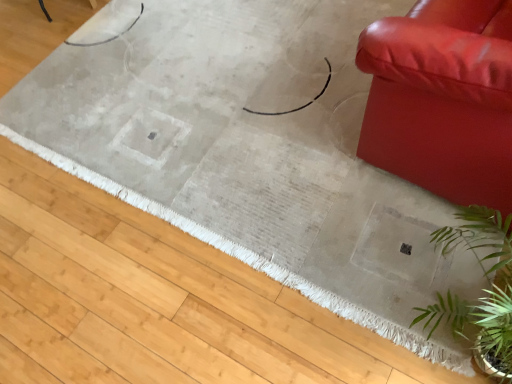
Question: Is beige woven rug at center taller or shorter than green leafy plant at lower right?

Choices:
 (A) short
 (B) tall

Answer: (A)

Question: Is beige woven rug at center in front of or behind green leafy plant at lower right in the image?

Choices:
 (A) front
 (B) behind

Answer: (B)

Question: Which object is the farthest from the green leafy plant at lower right?

Choices:
 (A) shiny leather couch at right
 (B) beige woven rug at center

Answer: (B)

Question: Which is nearer to the green leafy plant at lower right?

Choices:
 (A) beige woven rug at center
 (B) shiny leather couch at right

Answer: (B)